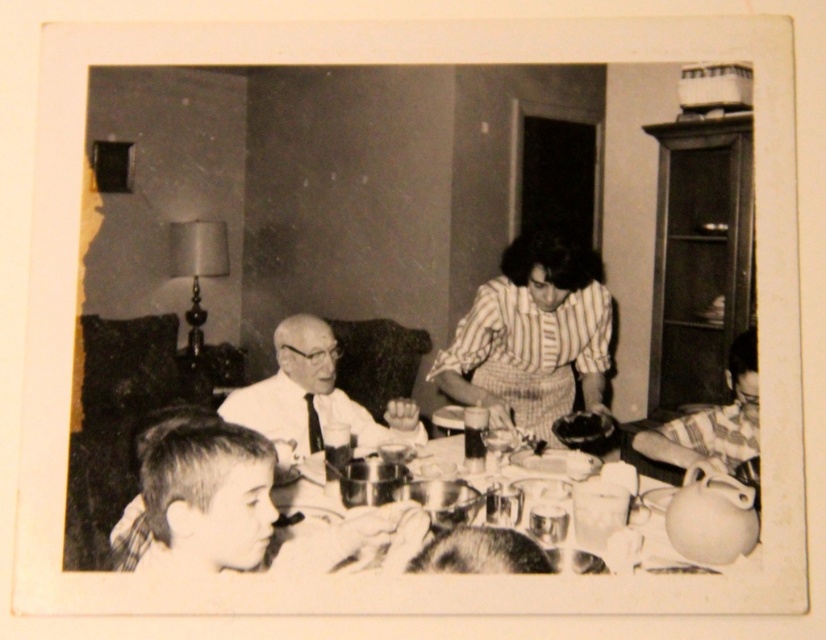
Question: Based on their relative distances, which object is nearer to the metallic reflective tableware at center?

Choices:
 (A) short hair at lower left
 (B) striped fabric dress at center

Answer: (B)

Question: Does striped fabric shirt at center appear on the right side of short hair at lower left?

Choices:
 (A) yes
 (B) no

Answer: (A)

Question: Which object appears closest to the camera in this image?

Choices:
 (A) metallic reflective tableware at center
 (B) striped fabric shirt at lower right
 (C) striped fabric shirt at center
 (D) white matte shirt at center

Answer: (C)

Question: Is striped fabric shirt at center further to the viewer compared to striped fabric dress at center?

Choices:
 (A) yes
 (B) no

Answer: (B)

Question: Estimate the real-world distances between objects in this image. Which object is farther from the short hair at lower left?

Choices:
 (A) metallic reflective tableware at center
 (B) striped fabric shirt at lower right
 (C) striped fabric dress at center
 (D) striped fabric shirt at center

Answer: (C)

Question: Does striped fabric shirt at center have a lesser width compared to striped fabric dress at center?

Choices:
 (A) yes
 (B) no

Answer: (B)